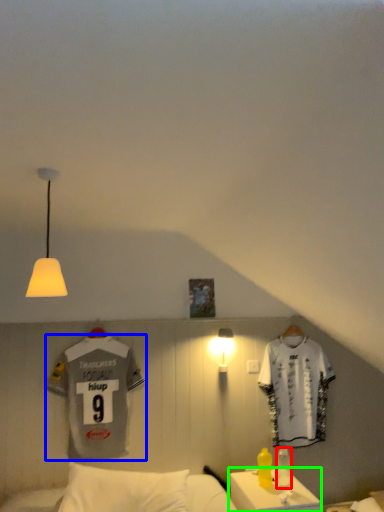
Question: Based on their relative distances, which object is farther from bottle (highlighted by a red box)? Choose from sports uniform (highlighted by a blue box) and table (highlighted by a green box).

Choices:
 (A) sports uniform
 (B) table

Answer: (A)